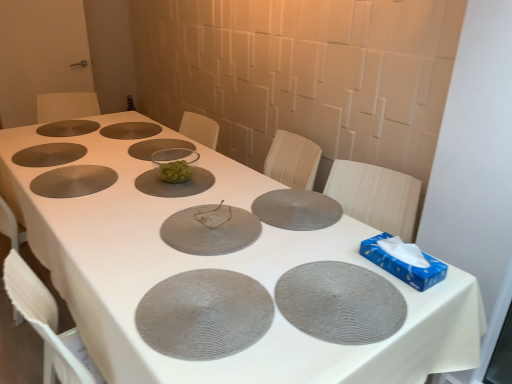
You are a GUI agent. You are given a task and a screenshot of the screen. Output one action in this format:
    pyautogui.click(x=<x>, y=<y>)
    Task: Click on the free area in between matte gray placemat at center, which ranks as the 4th glass plate in front-to-back order, and green glass bowl at center
    The image size is (512, 384).
    Given the screenshot: What is the action you would take?
    pyautogui.click(x=221, y=183)